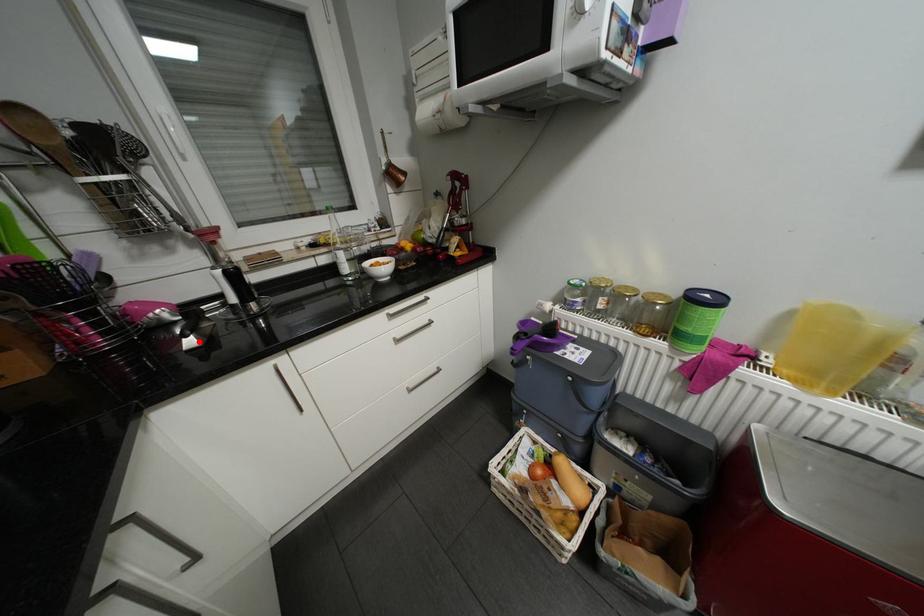
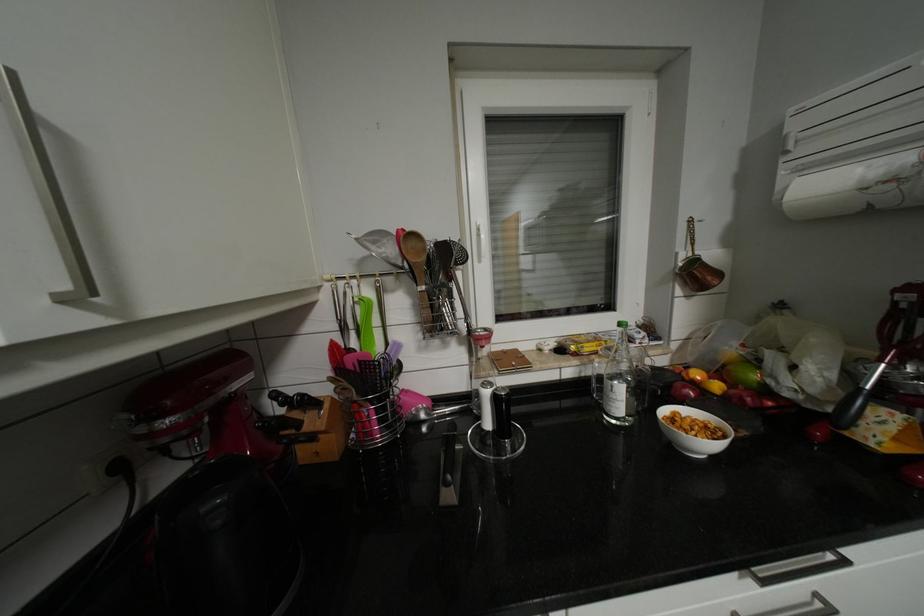
Question: I am providing you with two images of the same scene from different viewpoints. In image1, a red point is highlighted. Considering the same 3D point in image2, which of the following is correct?

Choices:
 (A) It is closer
 (B) It is farther

Answer: (B)